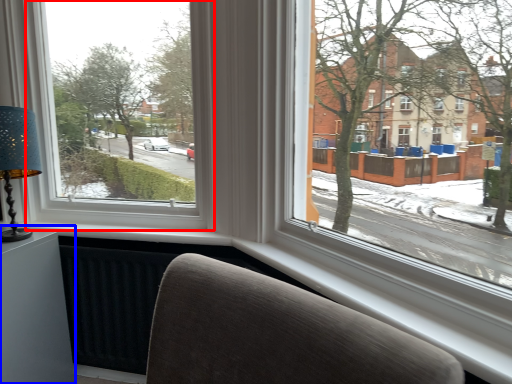
Question: Which of the following is the farthest to the observer, window (highlighted by a red box) or table (highlighted by a blue box)?

Choices:
 (A) window
 (B) table

Answer: (B)